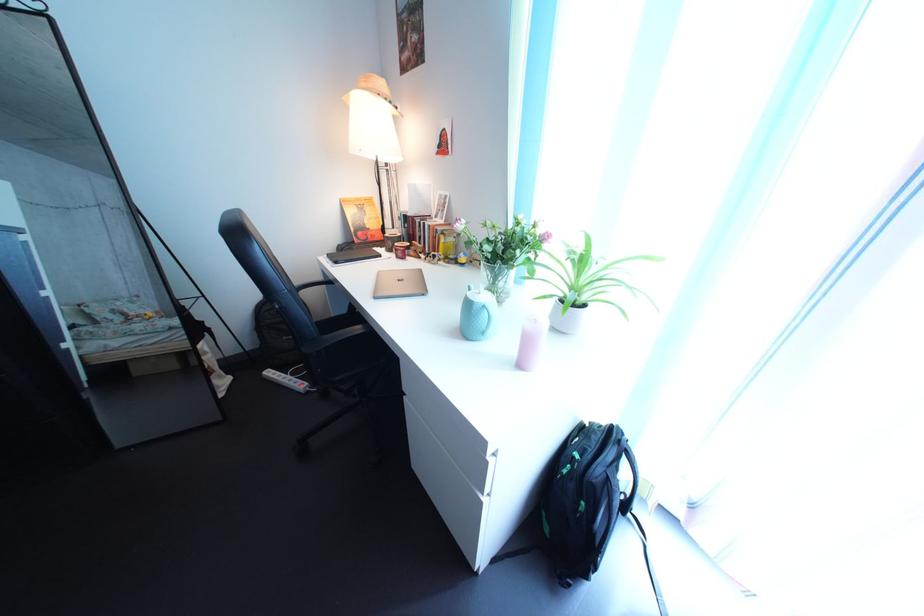
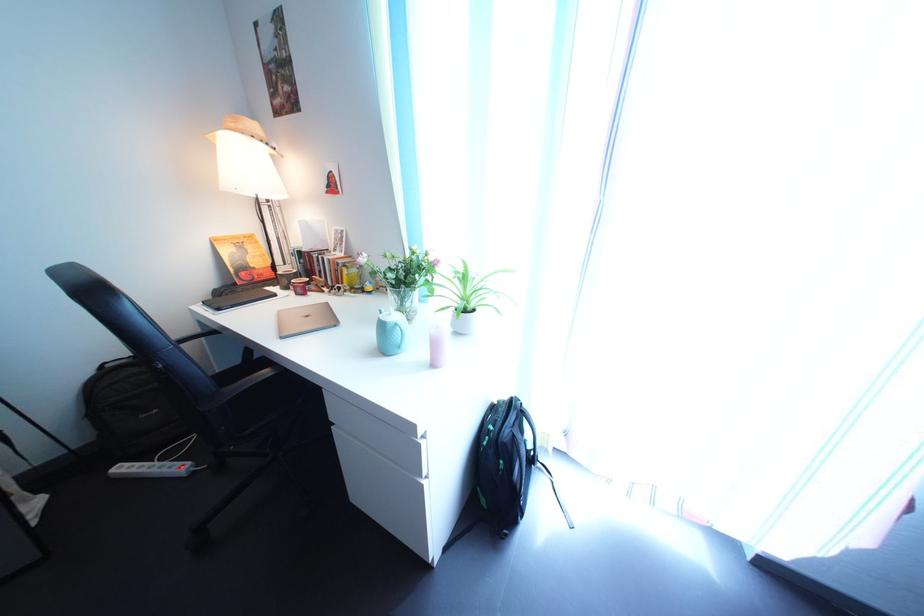
Question: The camera is either moving clockwise (left) or counter-clockwise (right) around the object. The first image is from the beginning of the video and the second image is from the end. Is the camera moving left or right when shooting the video?

Choices:
 (A) Left
 (B) Right

Answer: (A)